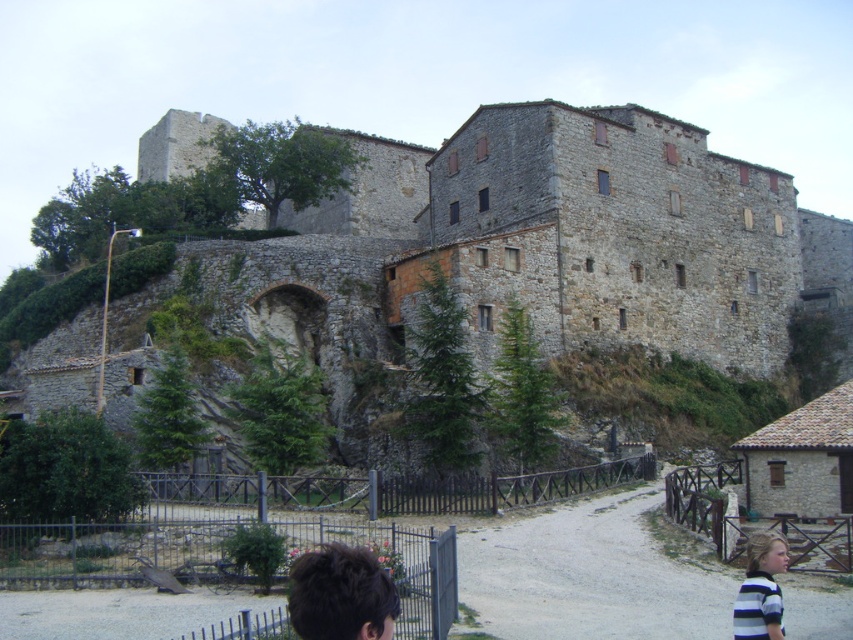
Between dark brown hair at lower center and striped fabric shirt at lower right, which one appears on the right side from the viewer's perspective?

striped fabric shirt at lower right is more to the right.

At what (x,y) coordinates should I click in order to perform the action: click on dark brown hair at lower center. Please return your answer as a coordinate pair (x, y). The image size is (853, 640). Looking at the image, I should click on (341, 595).

What do you see at coordinates (341, 595) in the screenshot? I see `dark brown hair at lower center` at bounding box center [341, 595].

This screenshot has width=853, height=640. Find the location of `dark brown hair at lower center`. dark brown hair at lower center is located at coordinates (341, 595).

Does stone castle at upper center appear on the left side of striped fabric shirt at lower right?

Indeed, stone castle at upper center is positioned on the left side of striped fabric shirt at lower right.

This screenshot has height=640, width=853. In order to click on stone castle at upper center in this screenshot , I will do `click(517, 253)`.

Does point (730, 214) come behind point (354, 557)?

Yes, it is.

Identify the location of stone castle at upper center. The width and height of the screenshot is (853, 640). (517, 253).